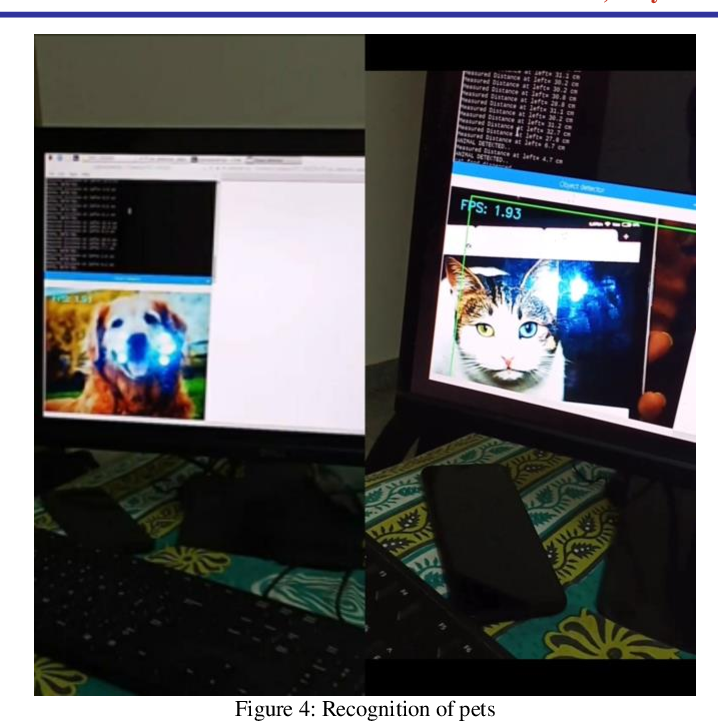
Image resolution: width=718 pixels, height=722 pixels. What are the coordinates of `computer` in the screenshot? It's located at (607, 419).